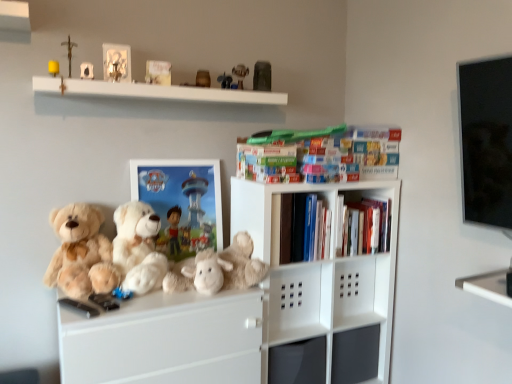
Question: Is hardcover books at upper center, which is counted as the second book, starting from the left, bigger than metal crucifix at upper left, the 2th toy from the left?

Choices:
 (A) yes
 (B) no

Answer: (A)

Question: From the image's perspective, would you say hardcover books at upper center, marked as the 2th book in a top-to-bottom arrangement, is shown under metal crucifix at upper left, the 2th toy from the left?

Choices:
 (A) yes
 (B) no

Answer: (A)

Question: Is hardcover books at upper center, marked as the 2th book in a top-to-bottom arrangement, at the right side of metal crucifix at upper left, which ranks as the 7th toy in right-to-left order?

Choices:
 (A) yes
 (B) no

Answer: (A)

Question: From a real-world perspective, is hardcover books at upper center, which is counted as the second book, starting from the left, physically above metal crucifix at upper left, which ranks as the 7th toy in right-to-left order?

Choices:
 (A) no
 (B) yes

Answer: (A)

Question: Can you confirm if hardcover books at upper center, marked as the second book in a bottom-to-top arrangement, is smaller than metal crucifix at upper left, which ranks as the 7th toy in right-to-left order?

Choices:
 (A) no
 (B) yes

Answer: (A)

Question: Is the surface of hardcover books at upper center, which is counted as the second book, starting from the left, in direct contact with metal crucifix at upper left, the 2th toy from the left?

Choices:
 (A) yes
 (B) no

Answer: (B)

Question: Can you confirm if yellow matte candle at upper left, the 1th toy positioned from the left, is bigger than matte plastic picture frame at center?

Choices:
 (A) no
 (B) yes

Answer: (A)

Question: From a real-world perspective, is yellow matte candle at upper left, the 8th toy viewed from the right, below matte plastic picture frame at center?

Choices:
 (A) yes
 (B) no

Answer: (B)

Question: Is yellow matte candle at upper left, the 8th toy viewed from the right, positioned in front of matte plastic picture frame at center?

Choices:
 (A) no
 (B) yes

Answer: (B)

Question: Can we say yellow matte candle at upper left, the 8th toy viewed from the right, lies outside matte plastic picture frame at center?

Choices:
 (A) no
 (B) yes

Answer: (B)

Question: Is yellow matte candle at upper left, the 8th toy viewed from the right, far away from matte plastic picture frame at center?

Choices:
 (A) no
 (B) yes

Answer: (A)

Question: Is yellow matte candle at upper left, the 1th toy positioned from the left, to the right of matte plastic picture frame at center from the viewer's perspective?

Choices:
 (A) yes
 (B) no

Answer: (B)

Question: From the image's perspective, does fluffy white teddy bear at center, which appears as the 1th teddy bear when viewed from the right, appear lower than metallic gray figurine at upper center, the first toy in the right-to-left sequence?

Choices:
 (A) yes
 (B) no

Answer: (A)